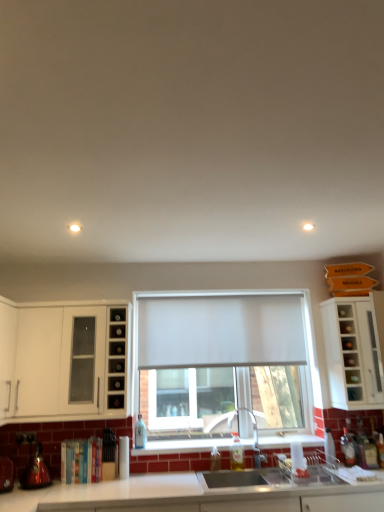
Question: From a real-world perspective, is metallic red kettle at lower left, which ranks as the first appliance in left-to-right order, located beneath translucent glass bottle at lower right, arranged as the 1th bottle when viewed from the right?

Choices:
 (A) no
 (B) yes

Answer: (B)

Question: Is metallic red kettle at lower left, which ranks as the first appliance in left-to-right order, at the right side of translucent glass bottle at lower right, arranged as the 1th bottle when viewed from the right?

Choices:
 (A) yes
 (B) no

Answer: (B)

Question: Is the position of metallic red kettle at lower left, the second appliance when ordered from right to left, less distant than that of translucent glass bottle at lower right, arranged as the 1th bottle when viewed from the right?

Choices:
 (A) no
 (B) yes

Answer: (B)

Question: Is metallic red kettle at lower left, the second appliance when ordered from right to left, further to the viewer compared to translucent glass bottle at lower right, arranged as the 1th bottle when viewed from the right?

Choices:
 (A) no
 (B) yes

Answer: (A)

Question: Are metallic red kettle at lower left, the second appliance when ordered from right to left, and translucent glass bottle at lower right, which appears as the sixth bottle when viewed from the left, located far from each other?

Choices:
 (A) yes
 (B) no

Answer: (A)

Question: Is metallic red kettle at lower left, which ranks as the first appliance in left-to-right order, turned away from translucent glass bottle at lower right, arranged as the 1th bottle when viewed from the right?

Choices:
 (A) no
 (B) yes

Answer: (A)

Question: Is translucent glass bottle at lower right, the second bottle in the right-to-left sequence, oriented towards white glossy cabinet at left, the 2th cabinetry when ordered from right to left?

Choices:
 (A) no
 (B) yes

Answer: (A)

Question: Considering the relative positions of translucent glass bottle at lower right, the fifth bottle positioned from the left, and white glossy cabinet at left, which is the 1th cabinetry in left-to-right order, in the image provided, is translucent glass bottle at lower right, the fifth bottle positioned from the left, to the left of white glossy cabinet at left, which is the 1th cabinetry in left-to-right order, from the viewer's perspective?

Choices:
 (A) yes
 (B) no

Answer: (B)

Question: From a real-world perspective, is translucent glass bottle at lower right, the second bottle in the right-to-left sequence, beneath white glossy cabinet at left, which is the 1th cabinetry in left-to-right order?

Choices:
 (A) yes
 (B) no

Answer: (A)

Question: From the image's perspective, is translucent glass bottle at lower right, the fifth bottle positioned from the left, beneath white glossy cabinet at left, which is the 1th cabinetry in left-to-right order?

Choices:
 (A) no
 (B) yes

Answer: (B)

Question: Is translucent glass bottle at lower right, the fifth bottle positioned from the left, oriented away from white glossy cabinet at left, the 2th cabinetry when ordered from right to left?

Choices:
 (A) yes
 (B) no

Answer: (B)

Question: Does translucent glass bottle at lower right, the second bottle in the right-to-left sequence, have a lesser height compared to white glossy cabinet at left, which is the 1th cabinetry in left-to-right order?

Choices:
 (A) no
 (B) yes

Answer: (B)

Question: Considering the relative sizes of shiny metallic kettle at lower left, the second appliance viewed from the left, and white glossy countertop at lower center in the image provided, is shiny metallic kettle at lower left, the second appliance viewed from the left, wider than white glossy countertop at lower center?

Choices:
 (A) yes
 (B) no

Answer: (B)